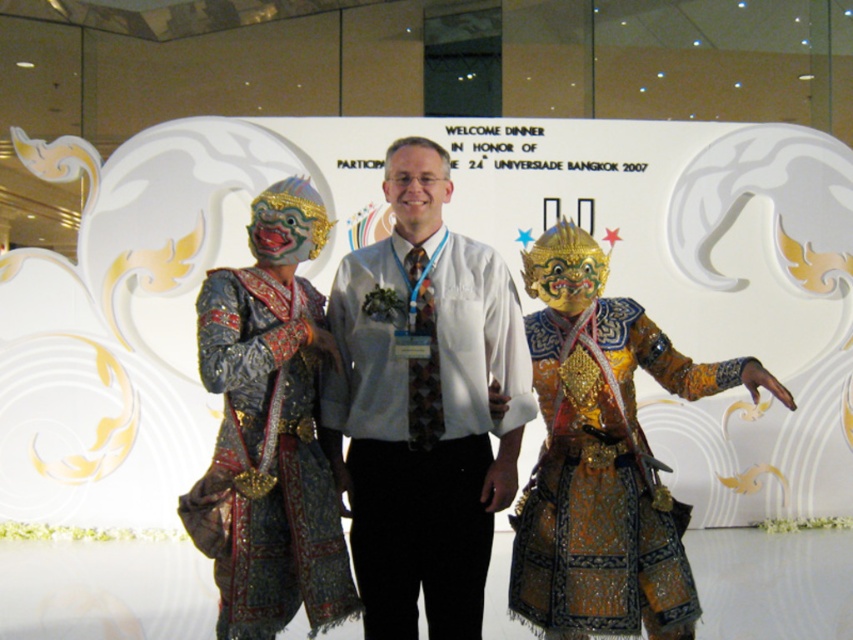
Is white shirt at center smaller than metallic gold mask at center?

No.

Can you confirm if white shirt at center is shorter than metallic gold mask at center?

No, white shirt at center is not shorter than metallic gold mask at center.

Image resolution: width=853 pixels, height=640 pixels. Find the location of `white shirt at center`. white shirt at center is located at coordinates (424, 426).

Does white shirt at center have a greater width compared to matte white shirt at center?

Yes.

Is point (477, 460) less distant than point (415, 195)?

That is True.

This screenshot has width=853, height=640. Find the location of `white shirt at center`. white shirt at center is located at coordinates (424, 426).

Does metallic fabric costumes at center have a larger size compared to white shirt at center?

Yes.

Is metallic fabric costumes at center above white shirt at center?

Indeed, metallic fabric costumes at center is positioned over white shirt at center.

Who is more forward, (x=457, y=440) or (x=480, y=561)?

Point (x=457, y=440)

Where is `metallic fabric costumes at center`? metallic fabric costumes at center is located at coordinates (498, 440).